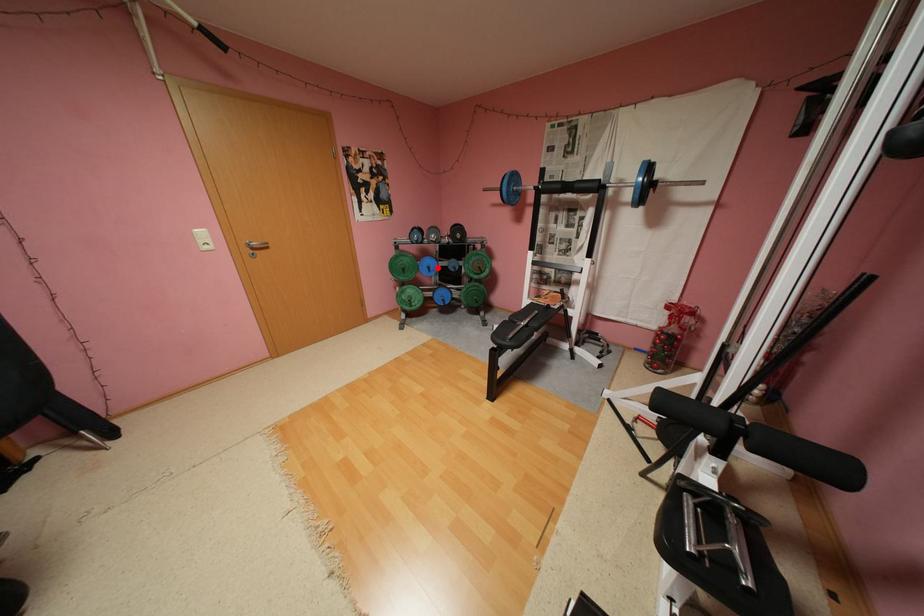
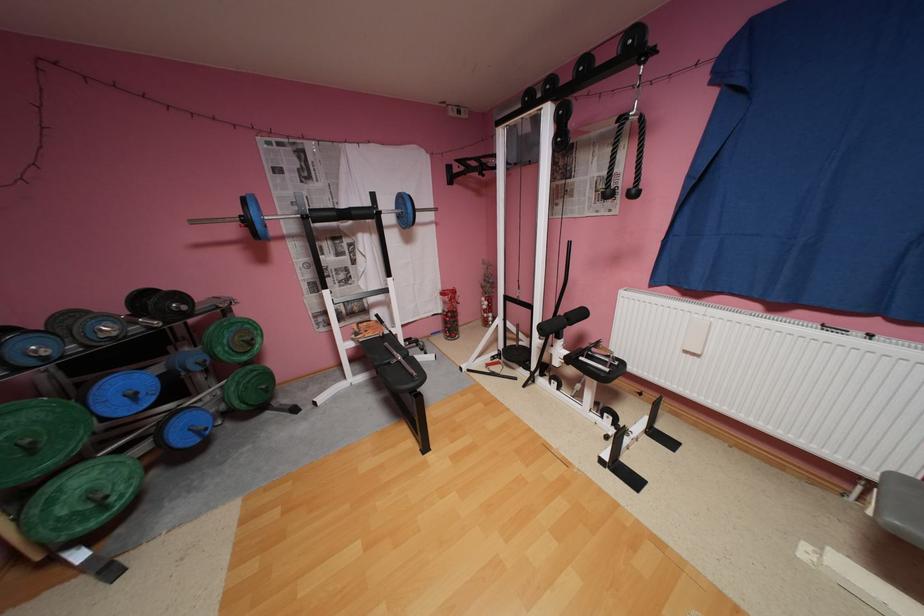
Question: A red point is marked in image1. In image2, is the corresponding 3D point closer to the camera or farther? Reply with the corresponding letter.

Choices:
 (A) The corresponding 3D point is closer.
 (B) The corresponding 3D point is farther.

Answer: (B)